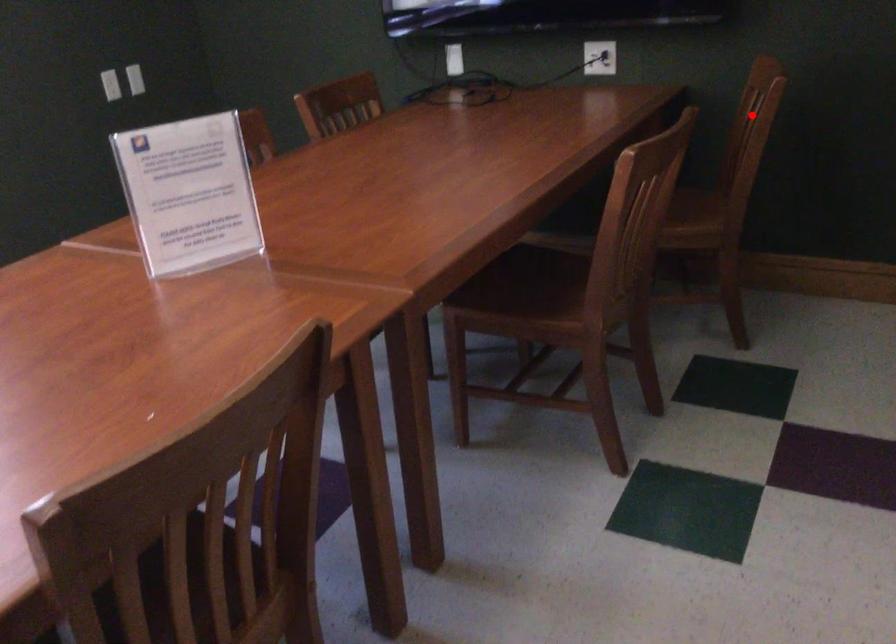
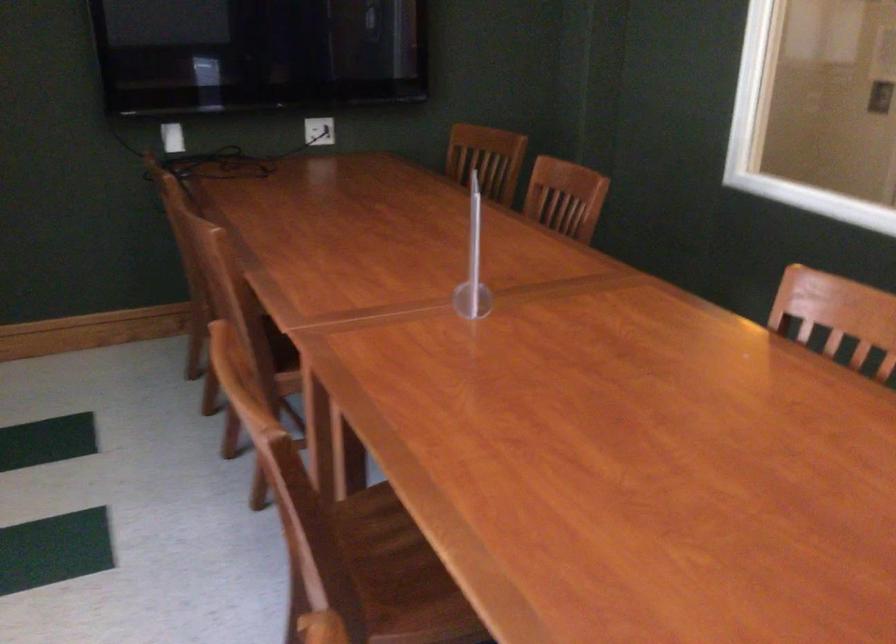
Question: I am providing you with two images of the same scene from different viewpoints. In image1, a red point is highlighted. Considering the same 3D point in image2, which of the following is correct?

Choices:
 (A) It is closer
 (B) It is farther

Answer: (B)